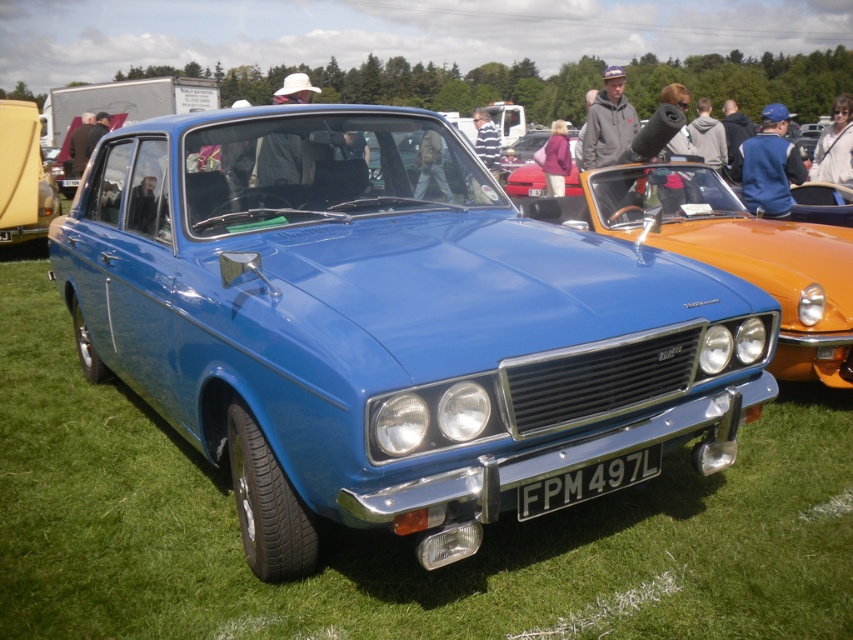
You are a photographer at the car show and need to capture the green grass at center and the white plastic license plate at center in a single shot. Which object will occupy more space in the photo?

The green grass at center is larger in size than the white plastic license plate at center, so it will occupy more space in the photo.

You are standing at the point marked by coordinates point at [781,525] and want to walk to the blue car. The path is clear except for a small fence that is 2 meters wide. Can you walk around the fence to reach the car?

The distance between you and the blue car is 3.37 meters. Since the fence is only 2 meters wide, you can easily walk around it to reach the car as the remaining distance after the fence would still allow passage.

Consider the image. You are a photographer at the car show and want to capture the white plastic license plate at center and the green grass at center in the same frame. Which object should you focus on first if you want to ensure both are in focus?

The green grass at center is located below the white plastic license plate at center. To ensure both are in focus, you should focus on the white plastic license plate at center first since it is closer to the camera.